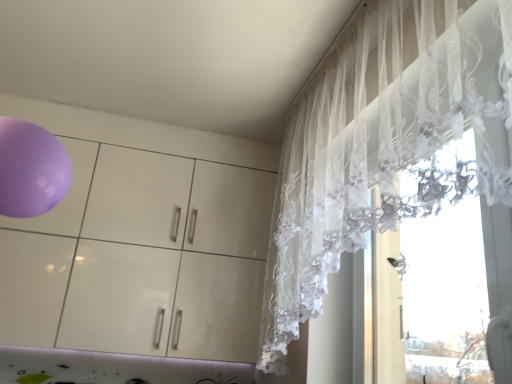
Question: Does glossy white dresser at upper left have a smaller size compared to white lace curtain at right?

Choices:
 (A) yes
 (B) no

Answer: (B)

Question: Could you tell me if glossy white dresser at upper left is facing white lace curtain at right?

Choices:
 (A) no
 (B) yes

Answer: (B)

Question: From a real-world perspective, is glossy white dresser at upper left physically above white lace curtain at right?

Choices:
 (A) no
 (B) yes

Answer: (A)

Question: Is glossy white dresser at upper left oriented away from white lace curtain at right?

Choices:
 (A) no
 (B) yes

Answer: (A)

Question: Can you confirm if glossy white dresser at upper left is shorter than white lace curtain at right?

Choices:
 (A) no
 (B) yes

Answer: (B)

Question: Are glossy white dresser at upper left and white lace curtain at right beside each other?

Choices:
 (A) yes
 (B) no

Answer: (B)

Question: From the image's perspective, is white lace curtain at right beneath glossy white dresser at upper left?

Choices:
 (A) yes
 (B) no

Answer: (B)

Question: Is white lace curtain at right to the right of glossy white dresser at upper left from the viewer's perspective?

Choices:
 (A) yes
 (B) no

Answer: (A)

Question: Is white lace curtain at right to the left of glossy white dresser at upper left from the viewer's perspective?

Choices:
 (A) no
 (B) yes

Answer: (A)

Question: From a real-world perspective, is white lace curtain at right located beneath glossy white dresser at upper left?

Choices:
 (A) no
 (B) yes

Answer: (A)

Question: Can you confirm if white lace curtain at right is wider than glossy white dresser at upper left?

Choices:
 (A) yes
 (B) no

Answer: (B)

Question: Considering the relative positions of white lace curtain at right and glossy white dresser at upper left in the image provided, is white lace curtain at right in front of glossy white dresser at upper left?

Choices:
 (A) yes
 (B) no

Answer: (A)

Question: Based on their sizes in the image, would you say glossy white dresser at upper left is bigger or smaller than white lace curtain at right?

Choices:
 (A) small
 (B) big

Answer: (B)